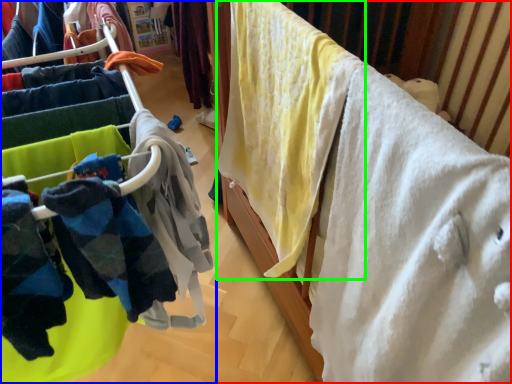
Question: Estimate the real-world distances between objects in this image. Which object is farther from furniture (highlighted by a red box), closet (highlighted by a blue box) or clothing (highlighted by a green box)?

Choices:
 (A) closet
 (B) clothing

Answer: (A)